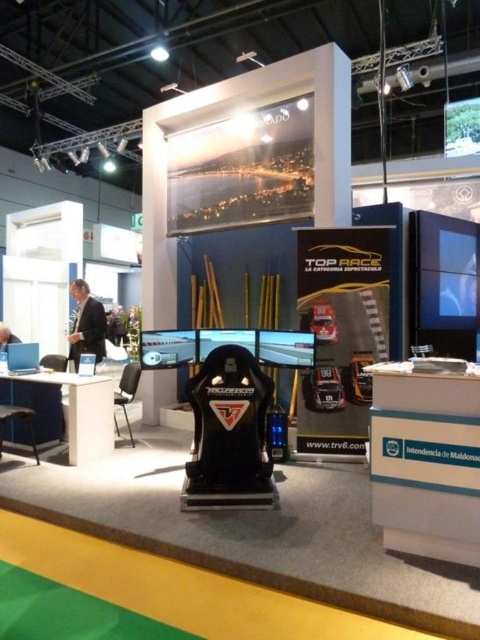
Question: Is black suit at left positioned behind matte black chair at lower left?

Choices:
 (A) no
 (B) yes

Answer: (B)

Question: Does black suit at left have a greater width compared to matte black chair at lower left?

Choices:
 (A) no
 (B) yes

Answer: (B)

Question: Which object is farther from the camera taking this photo?

Choices:
 (A) matte black chair at lower left
 (B) black suit at left

Answer: (B)

Question: Is black suit at left above matte black chair at lower left?

Choices:
 (A) yes
 (B) no

Answer: (A)